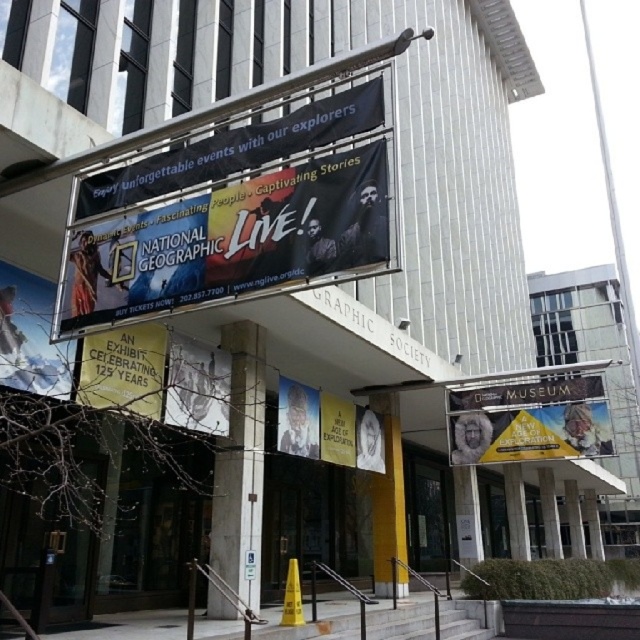
In the scene shown: Who is positioned more to the right, yellow fabric banner at center or yellow paper at center?

yellow fabric banner at center

Who is shorter, yellow fabric banner at center or yellow paper at center?

yellow paper at center is shorter.

What are the coordinates of `yellow fabric banner at center` in the screenshot? It's located at (529, 420).

Identify the location of yellow fabric banner at center. (529, 420).

Does point (145, 368) lie behind point (332, 429)?

No, (145, 368) is in front of (332, 429).

Is yellow paper at center to the right of white paper billboard at center from the viewer's perspective?

In fact, yellow paper at center is to the left of white paper billboard at center.

Who is more forward, (113, 381) or (321, 420)?

Positioned in front is point (113, 381).

Locate an element on the screen. This screenshot has width=640, height=640. yellow paper at center is located at coordinates [124, 369].

Is matte black banner at upper center wider than yellow paper at center?

Yes, matte black banner at upper center is wider than yellow paper at center.

Can you confirm if matte black banner at upper center is positioned below yellow paper at center?

Incorrect, matte black banner at upper center is not positioned below yellow paper at center.

Does point (150, 209) come farther from viewer compared to point (150, 330)?

That is False.

Locate an element on the screen. Image resolution: width=640 pixels, height=640 pixels. matte black banner at upper center is located at coordinates (232, 241).